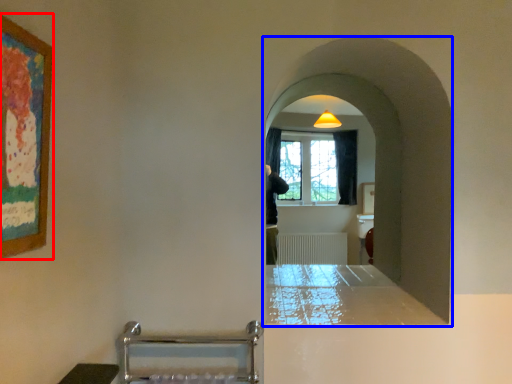
Question: Which of the following is the closest to the observer, picture frame (highlighted by a red box) or passage (highlighted by a blue box)?

Choices:
 (A) picture frame
 (B) passage

Answer: (A)